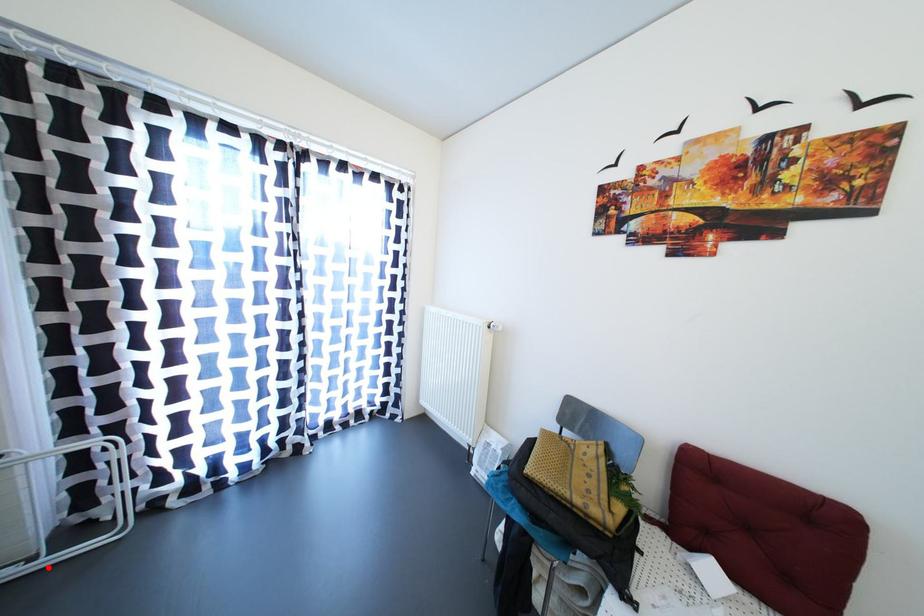
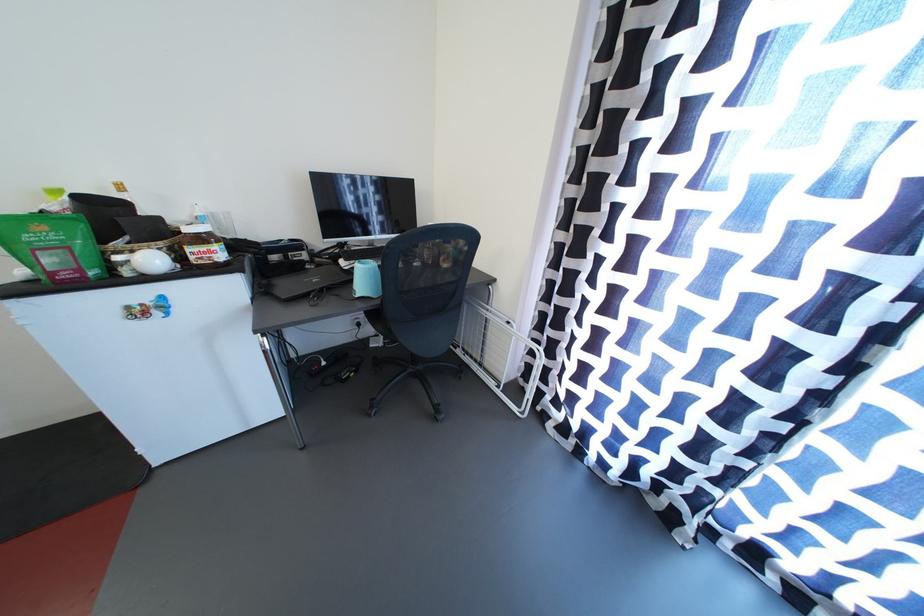
Locate, in the second image, the point that corresponds to the highlighted location in the first image.

(505, 397)